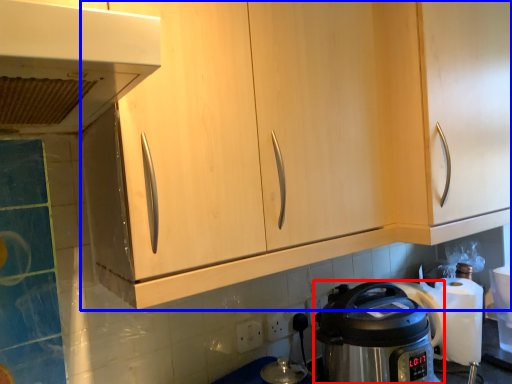
Question: Which of the following is the farthest to the observer, kitchen appliance (highlighted by a red box) or cabinetry (highlighted by a blue box)?

Choices:
 (A) kitchen appliance
 (B) cabinetry

Answer: (A)